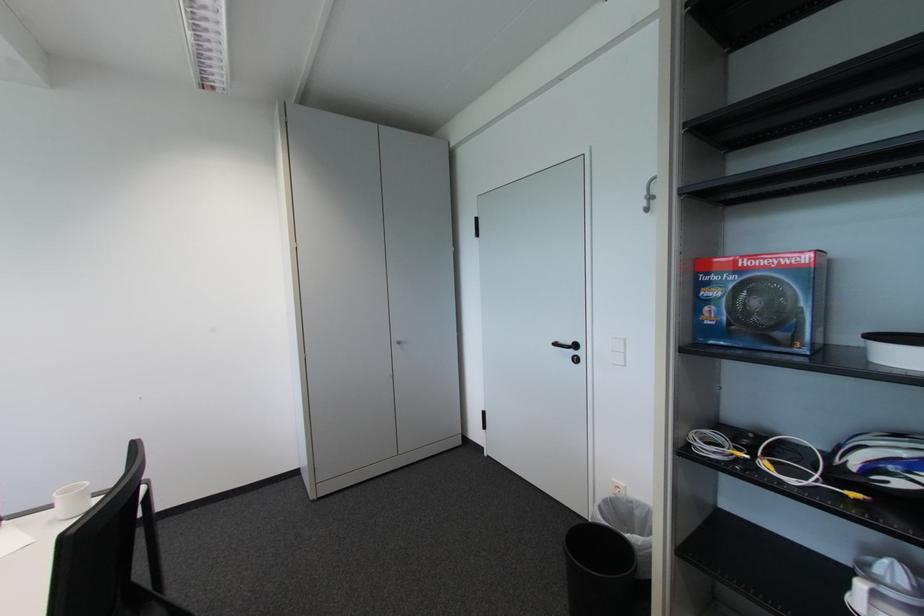
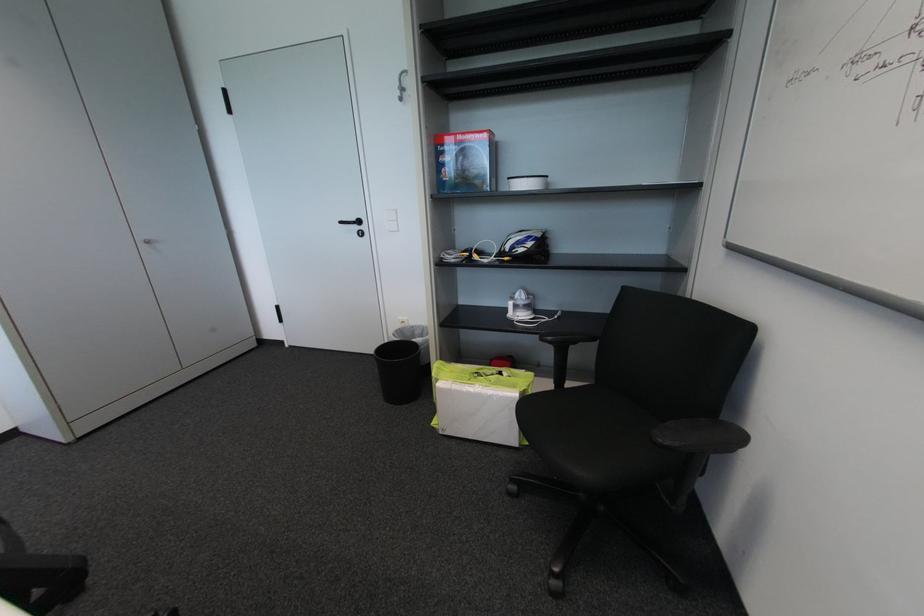
The point at (889,578) is marked in the first image. Where is the corresponding point in the second image?

(524, 301)